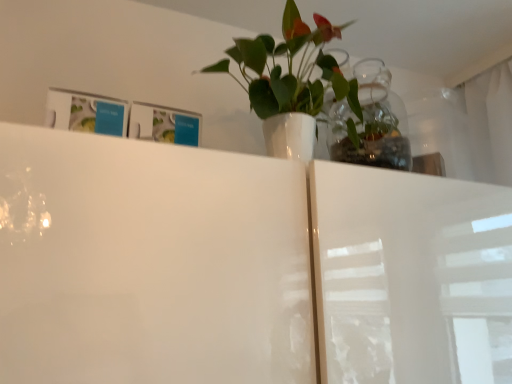
Question: Considering the positions of transparent glass vase at upper center and white glossy vase at upper center in the image, is transparent glass vase at upper center wider or thinner than white glossy vase at upper center?

Choices:
 (A) thin
 (B) wide

Answer: (A)

Question: Considering the positions of transparent glass vase at upper center and white glossy vase at upper center in the image, is transparent glass vase at upper center taller or shorter than white glossy vase at upper center?

Choices:
 (A) tall
 (B) short

Answer: (B)

Question: From the image's perspective, is transparent glass vase at upper center located above or below white glossy vase at upper center?

Choices:
 (A) below
 (B) above

Answer: (A)

Question: In terms of width, does white glossy vase at upper center look wider or thinner when compared to transparent glass vase at upper center?

Choices:
 (A) thin
 (B) wide

Answer: (B)

Question: Is point (308, 29) positioned closer to the camera than point (344, 102)?

Choices:
 (A) farther
 (B) closer

Answer: (B)

Question: Looking at the image, does white glossy vase at upper center seem bigger or smaller compared to transparent glass vase at upper center?

Choices:
 (A) small
 (B) big

Answer: (B)

Question: Is white glossy vase at upper center inside or outside of transparent glass vase at upper center?

Choices:
 (A) inside
 (B) outside

Answer: (B)